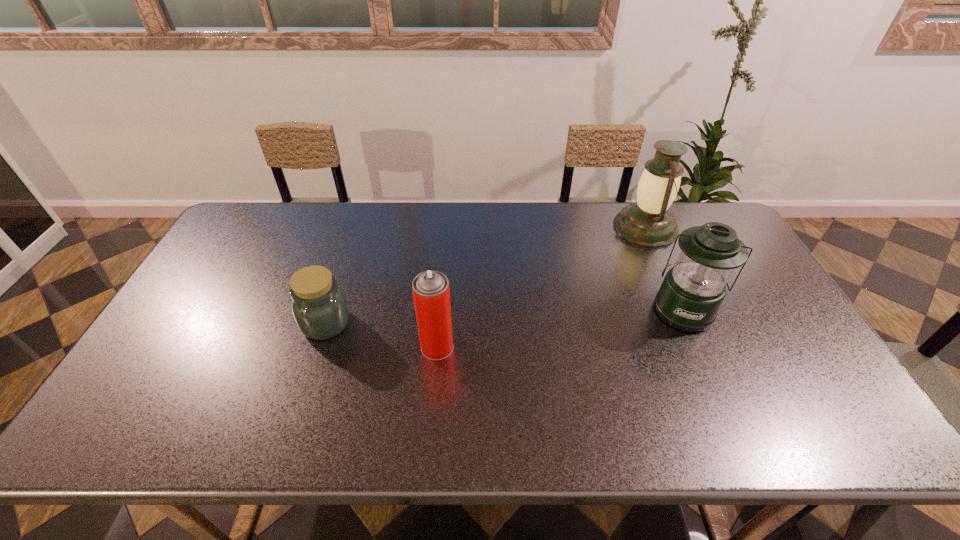
Identify the location of the farthest object. (648, 223).

The image size is (960, 540). Find the location of `the nearer lantern`. the nearer lantern is located at coordinates (692, 292).

This screenshot has height=540, width=960. I want to click on the third object from right to left, so click(x=431, y=293).

Locate an element on the screen. This screenshot has width=960, height=540. jar is located at coordinates click(319, 306).

Where is `the shortest object`? the shortest object is located at coordinates (319, 306).

Identify the location of free space located with the light compartment facing forward on the farthest object. This screenshot has width=960, height=540. (507, 227).

The height and width of the screenshot is (540, 960). Find the location of `vacant space located 0.140m with the light compartment facing forward on the farthest object`. vacant space located 0.140m with the light compartment facing forward on the farthest object is located at coordinates (573, 227).

Find the location of a particular element. This screenshot has height=540, width=960. vacant space located 0.070m with the light compartment facing forward on the farthest object is located at coordinates (593, 227).

You are a GUI agent. You are given a task and a screenshot of the screen. Output one action in this format:
    pyautogui.click(x=<x>, y=<y>)
    Task: Click on the vacant space situated 0.110m on the front of the nearer lantern
    This screenshot has height=540, width=960.
    Given the screenshot: What is the action you would take?
    pyautogui.click(x=709, y=368)

Identify the location of free region located 0.060m on the front of the second object from left to right. This screenshot has width=960, height=540. (434, 381).